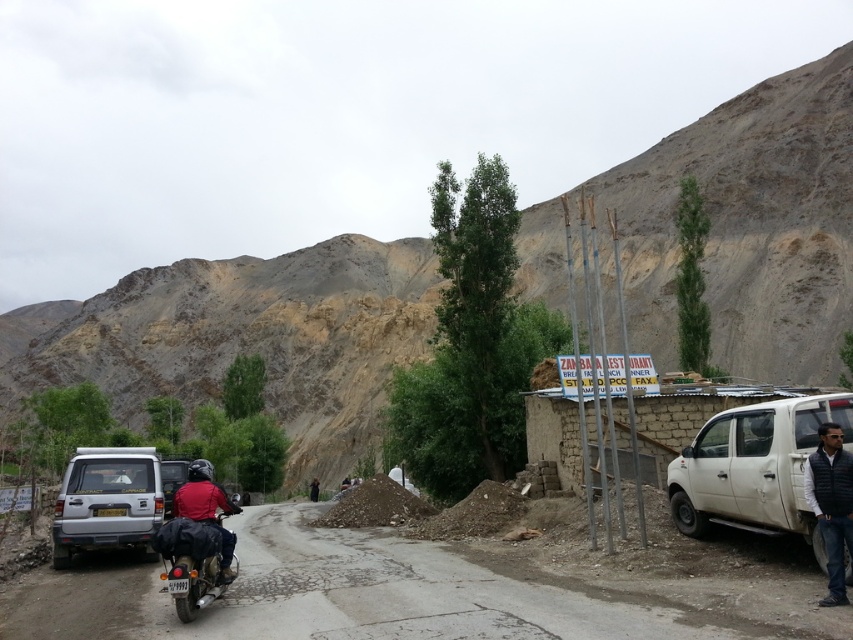
You are standing at the point marked by the coordinates (x=720, y=292) in the scene. A friend is driving the motorcyclist away from you along the road. How far will the motorcyclist be from you when they reach the curve?

The point marked by the coordinates (x=720, y=292) is 154.38 meters from the viewer. Since the motorcyclist is driving away from you towards the curve along the road, the distance between you and the motorcyclist will increase as they move further away. However, the exact distance when they reach the curve cannot be determined with the provided information.

You are a hiker planning to take a photo of the white matte truck at right from the brown rocky hillside at upper center. Can you see the truck from that vantage point?

The brown rocky hillside at upper center is positioned over the white matte truck at right, so yes, you can see the white matte truck at right from the brown rocky hillside at upper center because it is located below it.